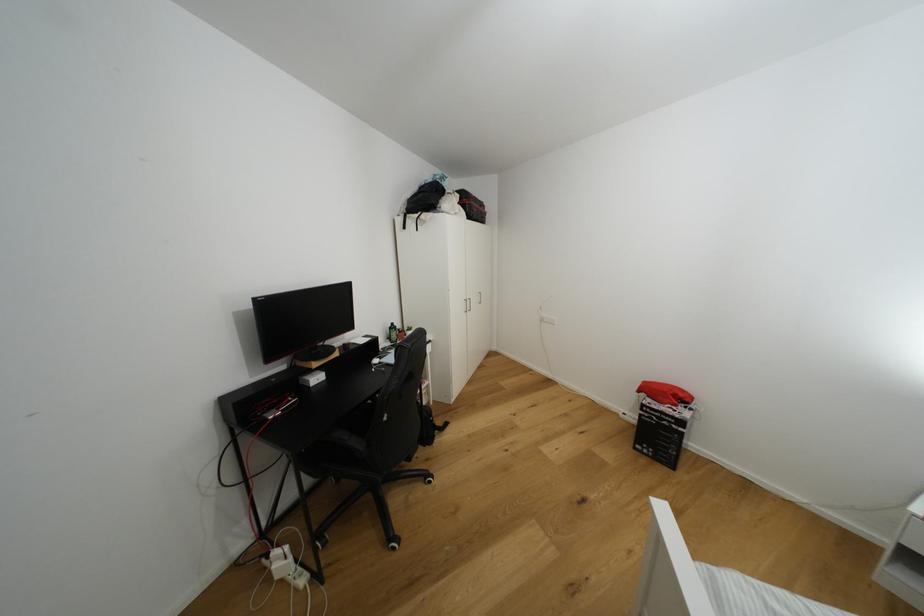
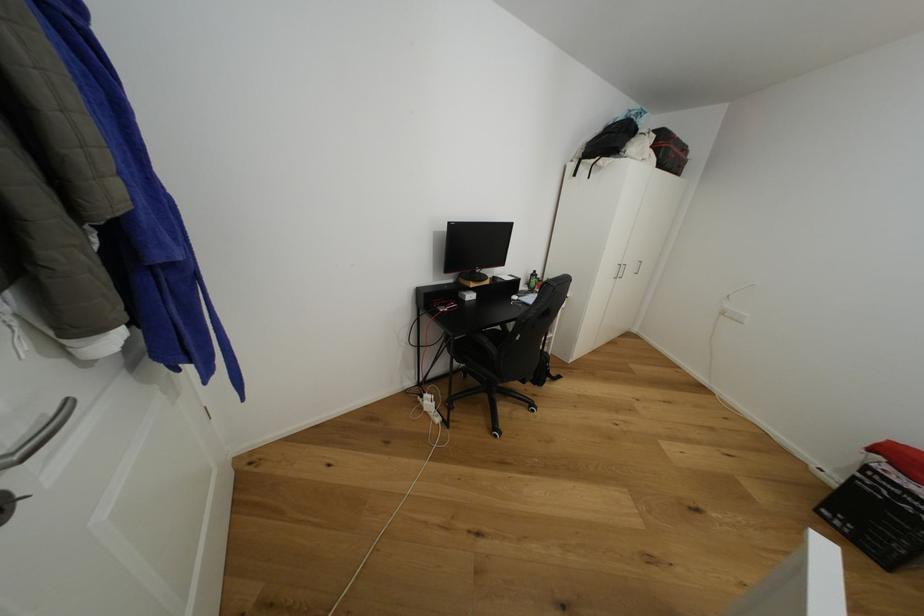
Locate, in the second image, the point that corresponds to point (653, 402) in the first image.

(893, 469)